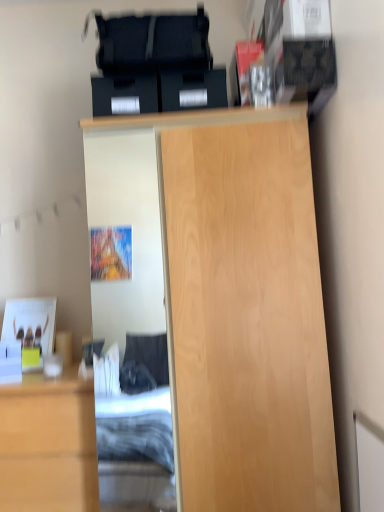
Question: In terms of height, does light wood cupboard at center look taller or shorter compared to light wood cabinet at lower left?

Choices:
 (A) short
 (B) tall

Answer: (B)

Question: Looking at their shapes, would you say light wood cupboard at center is wider or thinner than light wood cabinet at lower left?

Choices:
 (A) wide
 (B) thin

Answer: (A)

Question: From the image's perspective, is light wood cupboard at center positioned above or below light wood cabinet at lower left?

Choices:
 (A) above
 (B) below

Answer: (A)

Question: From their relative heights in the image, would you say light wood cabinet at lower left is taller or shorter than light wood cupboard at center?

Choices:
 (A) tall
 (B) short

Answer: (B)

Question: Is light wood cabinet at lower left spatially inside light wood cupboard at center, or outside of it?

Choices:
 (A) outside
 (B) inside

Answer: (A)

Question: Does point (6, 468) appear closer or farther from the camera than point (231, 218)?

Choices:
 (A) farther
 (B) closer

Answer: (A)

Question: Based on their positions, is light wood cabinet at lower left located to the left or right of light wood cupboard at center?

Choices:
 (A) left
 (B) right

Answer: (A)